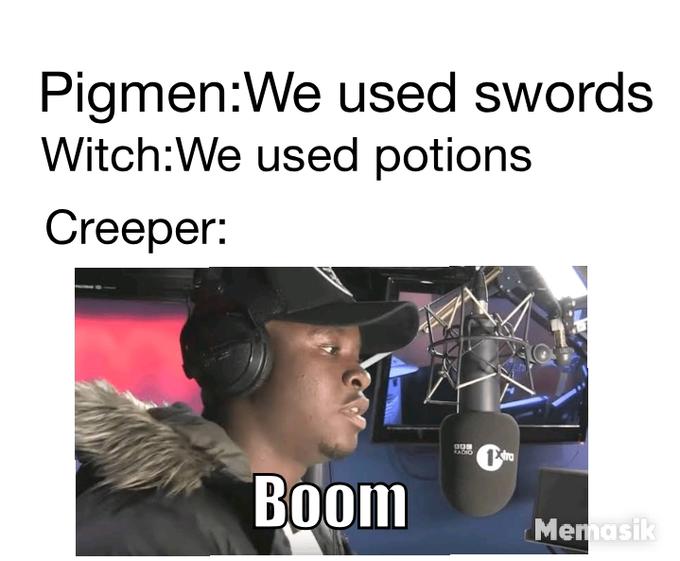
Identify the location of mirror. Image resolution: width=680 pixels, height=561 pixels. (413, 390).